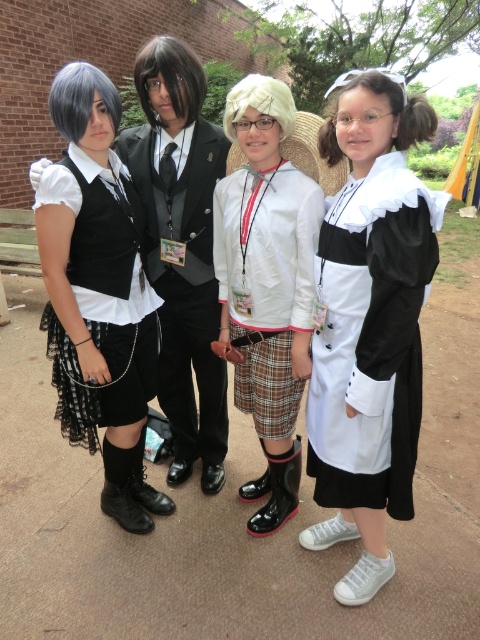
Question: Which point is closer to the camera?

Choices:
 (A) white matte wig at center
 (B) blonde synthetic wig at upper right
 (C) white matte dress at center
 (D) black lace dress at left

Answer: (C)

Question: Observing the image, what is the correct spatial positioning of white matte jacket at center in reference to white matte wig at center?

Choices:
 (A) right
 (B) left

Answer: (A)

Question: Is white matte dress at center smaller than white matte wig at center?

Choices:
 (A) no
 (B) yes

Answer: (A)

Question: Which point is closer to the camera taking this photo?

Choices:
 (A) (117, 97)
 (B) (424, 138)
 (C) (96, 300)

Answer: (B)

Question: Can you confirm if white matte dress at center is wider than white matte jacket at center?

Choices:
 (A) yes
 (B) no

Answer: (B)

Question: Which of the following is the closest to the observer?

Choices:
 (A) dark brown synthetic wig at center
 (B) white matte wig at center

Answer: (B)